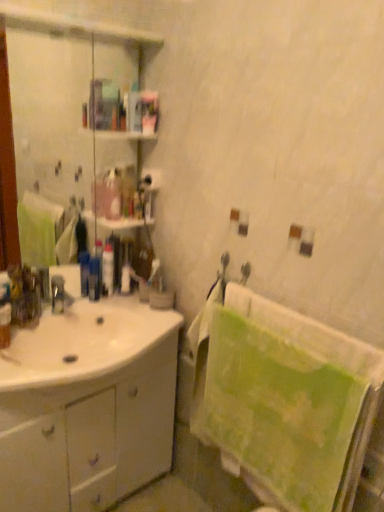
Question: Could you tell me if green textured towel at right is facing white matte toilet paper at upper center?

Choices:
 (A) yes
 (B) no

Answer: (B)

Question: Considering the relative sizes of green textured towel at right and white matte toilet paper at upper center in the image provided, is green textured towel at right thinner than white matte toilet paper at upper center?

Choices:
 (A) yes
 (B) no

Answer: (B)

Question: Considering the relative sizes of green textured towel at right and white matte toilet paper at upper center in the image provided, is green textured towel at right bigger than white matte toilet paper at upper center?

Choices:
 (A) no
 (B) yes

Answer: (B)

Question: From a real-world perspective, is green textured towel at right on top of white matte toilet paper at upper center?

Choices:
 (A) yes
 (B) no

Answer: (B)

Question: Is green textured towel at right looking in the opposite direction of white matte toilet paper at upper center?

Choices:
 (A) no
 (B) yes

Answer: (A)

Question: In the image, is white glossy sink at lower left positioned in front of or behind clear glass mirror at upper left?

Choices:
 (A) behind
 (B) front

Answer: (B)

Question: Which is correct: white glossy sink at lower left is inside clear glass mirror at upper left, or outside of it?

Choices:
 (A) inside
 (B) outside

Answer: (B)

Question: From their relative heights in the image, would you say white glossy sink at lower left is taller or shorter than clear glass mirror at upper left?

Choices:
 (A) short
 (B) tall

Answer: (A)

Question: From a real-world perspective, is white glossy sink at lower left positioned above or below clear glass mirror at upper left?

Choices:
 (A) above
 (B) below

Answer: (B)

Question: Considering the positions of blue plastic toothbrush at center, which ranks as the 3th toiletry in right-to-left order, and white matte toilet paper at upper center in the image, is blue plastic toothbrush at center, which ranks as the 3th toiletry in right-to-left order, wider or thinner than white matte toilet paper at upper center?

Choices:
 (A) wide
 (B) thin

Answer: (A)

Question: Choose the correct answer: Is blue plastic toothbrush at center, the 1th toiletry viewed from the left, inside white matte toilet paper at upper center or outside it?

Choices:
 (A) outside
 (B) inside

Answer: (A)

Question: From the image's perspective, is blue plastic toothbrush at center, which ranks as the 3th toiletry in right-to-left order, located above or below white matte toilet paper at upper center?

Choices:
 (A) above
 (B) below

Answer: (B)

Question: From a real-world perspective, is blue plastic toothbrush at center, the 1th toiletry viewed from the left, above or below white matte toilet paper at upper center?

Choices:
 (A) above
 (B) below

Answer: (B)

Question: Considering the positions of green textured towel at right and white glossy cabinet at left in the image, is green textured towel at right wider or thinner than white glossy cabinet at left?

Choices:
 (A) wide
 (B) thin

Answer: (B)

Question: Considering the positions of point [x=299, y=354] and point [x=99, y=467], is point [x=299, y=354] closer or farther from the camera than point [x=99, y=467]?

Choices:
 (A) farther
 (B) closer

Answer: (B)